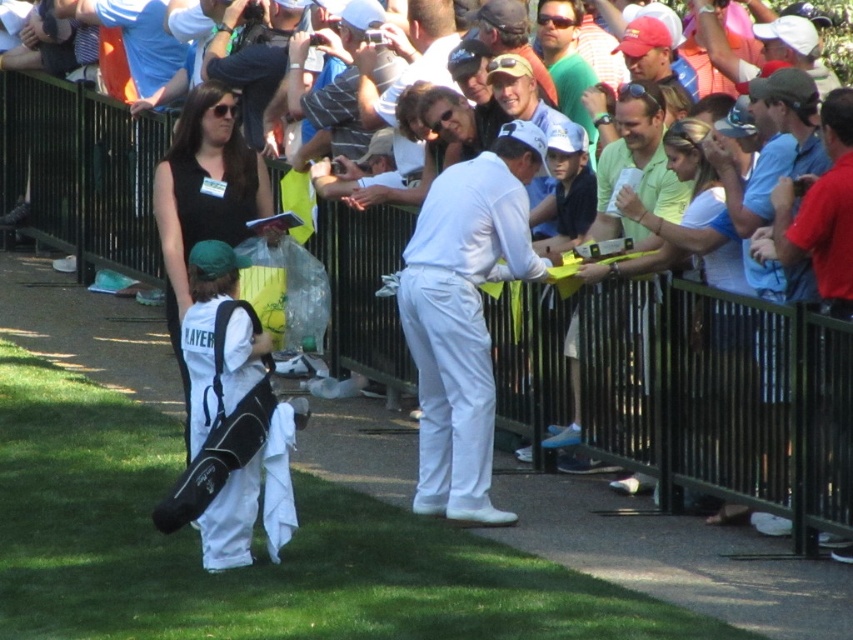
Between white matte golf pants at center and red shirt at center, which one is positioned higher?

Positioned higher is red shirt at center.

Identify the location of white matte golf pants at center. coord(463,316).

The image size is (853, 640). I want to click on white matte golf pants at center, so pyautogui.click(x=463, y=316).

Based on the photo, who is taller, white matte golf pants at center or light green shirt at center?

Standing taller between the two is white matte golf pants at center.

Is white matte golf pants at center smaller than light green shirt at center?

No.

Is point (524, 227) farther from viewer compared to point (635, 266)?

No.

Find the location of `white matte golf pants at center`. white matte golf pants at center is located at coordinates click(463, 316).

Which is above, light green shirt at center or red shirt at center?

light green shirt at center is above.

Is light green shirt at center bigger than red shirt at center?

Yes.

Between point (645, 198) and point (798, 228), which one is positioned in front?

Point (798, 228) is more forward.

Locate an element on the screen. light green shirt at center is located at coordinates tap(637, 164).